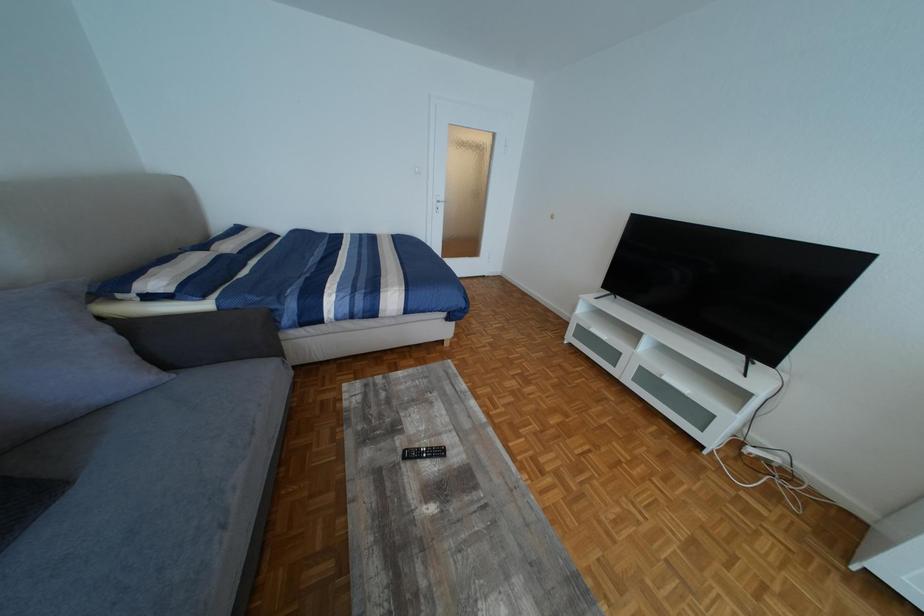
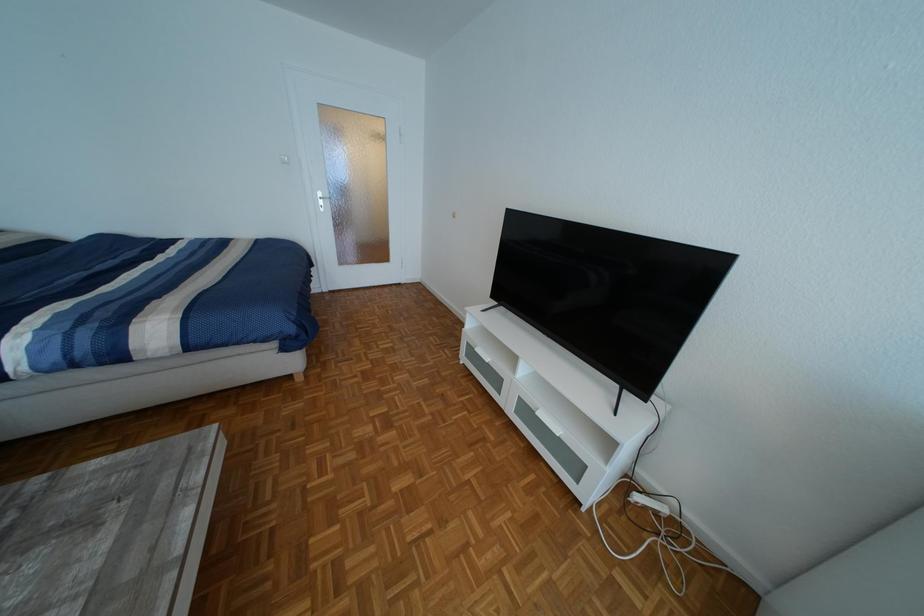
Question: How did the camera likely rotate?

Choices:
 (A) Left
 (B) Right
 (C) Up
 (D) Down

Answer: (B)